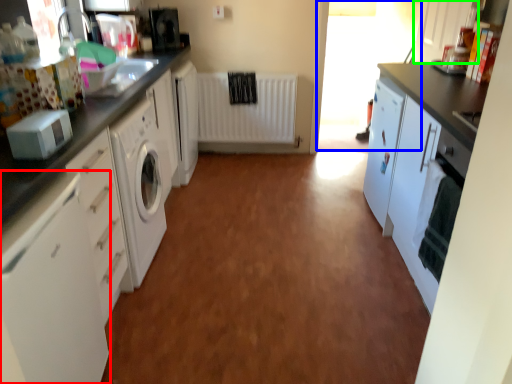
Question: Which object is the closest to the cabinetry (highlighted by a red box)? Choose among these: window screen (highlighted by a blue box) or cabinetry (highlighted by a green box).

Choices:
 (A) window screen
 (B) cabinetry

Answer: (B)